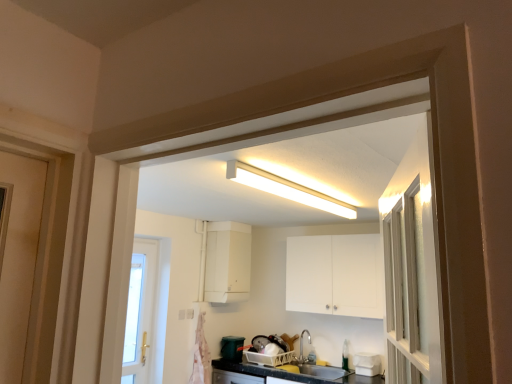
Question: Is white matte cabinet at upper center, which appears as the 1th cabinetry when viewed from the left, wider than white fluorescent light at upper center?

Choices:
 (A) yes
 (B) no

Answer: (A)

Question: Is white matte cabinet at upper center, which appears as the 1th cabinetry when viewed from the left, located outside white fluorescent light at upper center?

Choices:
 (A) yes
 (B) no

Answer: (A)

Question: Is white matte cabinet at upper center, which appears as the 1th cabinetry when viewed from the left, facing away from white fluorescent light at upper center?

Choices:
 (A) no
 (B) yes

Answer: (A)

Question: Is white matte cabinet at upper center, positioned as the 2th cabinetry in right-to-left order, facing towards white fluorescent light at upper center?

Choices:
 (A) no
 (B) yes

Answer: (A)

Question: From a real-world perspective, is white matte cabinet at upper center, which appears as the 1th cabinetry when viewed from the left, located higher than white fluorescent light at upper center?

Choices:
 (A) yes
 (B) no

Answer: (B)

Question: Can you confirm if white matte cabinet at upper center, positioned as the 2th cabinetry in right-to-left order, is bigger than white fluorescent light at upper center?

Choices:
 (A) no
 (B) yes

Answer: (B)

Question: Is white matte cabinet at upper center, positioned as the 2th cabinetry in right-to-left order, smaller than satin nickel faucet at lower center?

Choices:
 (A) yes
 (B) no

Answer: (B)

Question: Is white matte cabinet at upper center, positioned as the 2th cabinetry in right-to-left order, facing towards satin nickel faucet at lower center?

Choices:
 (A) yes
 (B) no

Answer: (B)

Question: Is white matte cabinet at upper center, positioned as the 2th cabinetry in right-to-left order, wider than satin nickel faucet at lower center?

Choices:
 (A) yes
 (B) no

Answer: (A)

Question: From the image's perspective, is white matte cabinet at upper center, positioned as the 2th cabinetry in right-to-left order, on top of satin nickel faucet at lower center?

Choices:
 (A) no
 (B) yes

Answer: (B)

Question: Is white matte cabinet at upper center, which appears as the 1th cabinetry when viewed from the left, far from satin nickel faucet at lower center?

Choices:
 (A) no
 (B) yes

Answer: (B)

Question: From a real-world perspective, is white matte cabinet at upper center, which appears as the 1th cabinetry when viewed from the left, physically below satin nickel faucet at lower center?

Choices:
 (A) no
 (B) yes

Answer: (A)

Question: Does white fluorescent light at upper center appear on the left side of white plastic electric outlet at lower center?

Choices:
 (A) no
 (B) yes

Answer: (A)